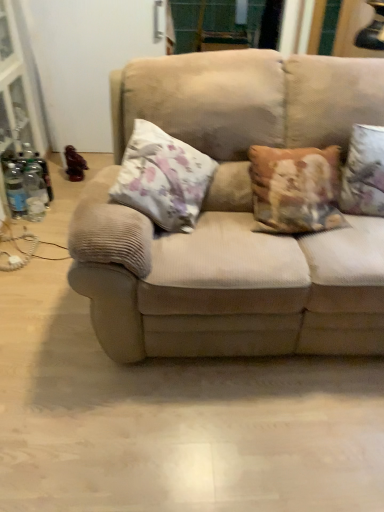
Question: Can you confirm if floral fabric pillow at right, which appears as the 1th pillow when viewed from the right, is positioned to the left of beige corduroy couch at center?

Choices:
 (A) yes
 (B) no

Answer: (B)

Question: From the image's perspective, is floral fabric pillow at right, acting as the 2th pillow starting from the left, above beige corduroy couch at center?

Choices:
 (A) yes
 (B) no

Answer: (A)

Question: From the image's perspective, does floral fabric pillow at right, which appears as the 1th pillow when viewed from the right, appear lower than beige corduroy couch at center?

Choices:
 (A) no
 (B) yes

Answer: (A)

Question: Can you confirm if floral fabric pillow at right, acting as the 2th pillow starting from the left, is thinner than beige corduroy couch at center?

Choices:
 (A) yes
 (B) no

Answer: (A)

Question: Is floral fabric pillow at right, acting as the 2th pillow starting from the left, looking in the opposite direction of beige corduroy couch at center?

Choices:
 (A) yes
 (B) no

Answer: (A)

Question: In terms of width, does floral fabric pillow at center, the first pillow in the left-to-right sequence, look wider or thinner when compared to beige corduroy couch at center?

Choices:
 (A) thin
 (B) wide

Answer: (A)

Question: From their relative heights in the image, would you say floral fabric pillow at center, arranged as the second pillow when viewed from the right, is taller or shorter than beige corduroy couch at center?

Choices:
 (A) tall
 (B) short

Answer: (B)

Question: Is floral fabric pillow at center, the first pillow in the left-to-right sequence, in front of or behind beige corduroy couch at center in the image?

Choices:
 (A) front
 (B) behind

Answer: (B)

Question: From the image's perspective, is floral fabric pillow at center, arranged as the second pillow when viewed from the right, above or below beige corduroy couch at center?

Choices:
 (A) below
 (B) above

Answer: (B)

Question: From a real-world perspective, is floral fabric pillow at right, which appears as the 1th pillow when viewed from the right, physically located above or below floral fabric pillow at center, the first pillow in the left-to-right sequence?

Choices:
 (A) below
 (B) above

Answer: (B)

Question: Is floral fabric pillow at right, which appears as the 1th pillow when viewed from the right, wider or thinner than floral fabric pillow at center, arranged as the second pillow when viewed from the right?

Choices:
 (A) wide
 (B) thin

Answer: (B)

Question: From the image's perspective, is floral fabric pillow at right, acting as the 2th pillow starting from the left, above or below floral fabric pillow at center, the first pillow in the left-to-right sequence?

Choices:
 (A) above
 (B) below

Answer: (A)

Question: Considering the relative positions of floral fabric pillow at right, which appears as the 1th pillow when viewed from the right, and floral fabric pillow at center, arranged as the second pillow when viewed from the right, in the image provided, is floral fabric pillow at right, which appears as the 1th pillow when viewed from the right, to the left or to the right of floral fabric pillow at center, arranged as the second pillow when viewed from the right,?

Choices:
 (A) left
 (B) right

Answer: (B)

Question: From the image's perspective, is beige corduroy couch at center above or below floral fabric pillow at center, the first pillow in the left-to-right sequence?

Choices:
 (A) above
 (B) below

Answer: (B)

Question: From a real-world perspective, is beige corduroy couch at center positioned above or below floral fabric pillow at center, the first pillow in the left-to-right sequence?

Choices:
 (A) above
 (B) below

Answer: (B)